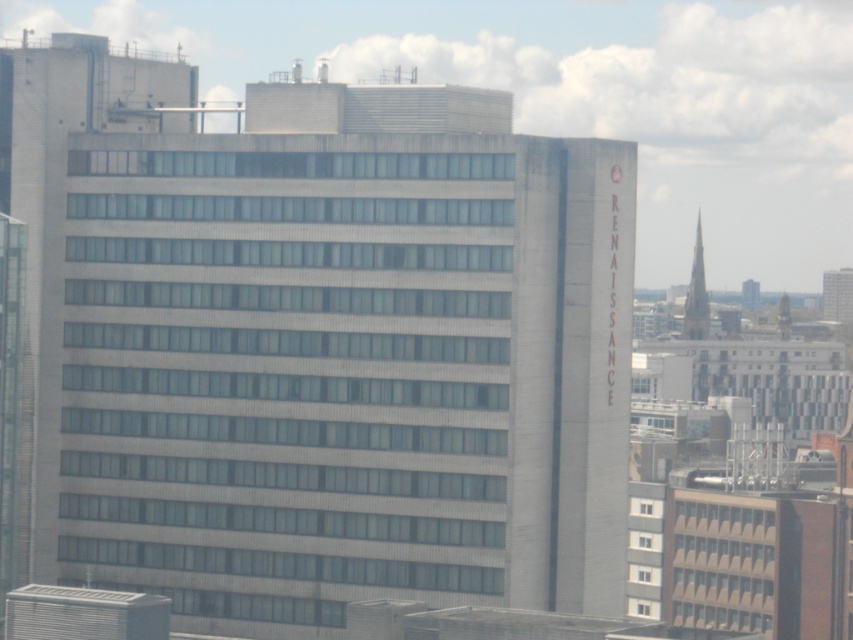
Does white concrete building at center lie in front of smooth gray steeple at upper right?

Yes.

Who is taller, white concrete building at center or smooth gray steeple at upper right?

white concrete building at center is taller.

Does point (430, 253) lie in front of point (703, 273)?

Yes, it is in front of point (703, 273).

The width and height of the screenshot is (853, 640). I want to click on white concrete building at center, so (338, 358).